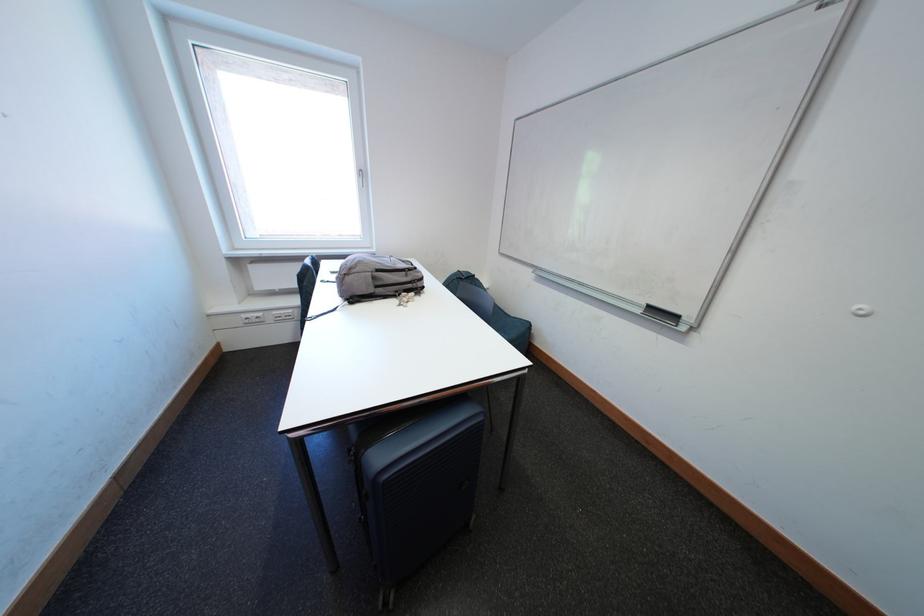
Image resolution: width=924 pixels, height=616 pixels. Identify the location of chair sitting surface. (505, 323).